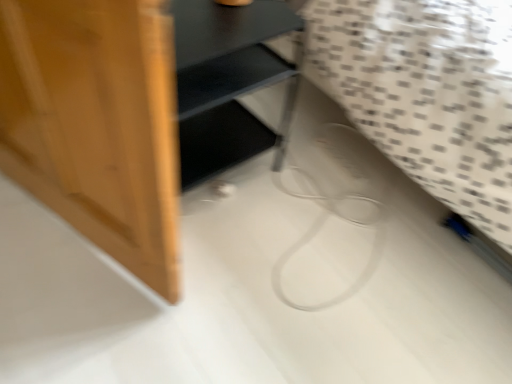
Question: Is matte black shelf at center taller or shorter than white textured fabric at lower right?

Choices:
 (A) short
 (B) tall

Answer: (A)

Question: In the image, is matte black shelf at center on the left side or the right side of white textured fabric at lower right?

Choices:
 (A) right
 (B) left

Answer: (B)

Question: Is matte black shelf at center inside or outside of white textured fabric at lower right?

Choices:
 (A) outside
 (B) inside

Answer: (A)

Question: Choose the correct answer: Is white textured fabric at lower right inside matte black shelf at center or outside it?

Choices:
 (A) inside
 (B) outside

Answer: (B)

Question: From their relative heights in the image, would you say white textured fabric at lower right is taller or shorter than matte black shelf at center?

Choices:
 (A) short
 (B) tall

Answer: (B)

Question: In the image, is white textured fabric at lower right positioned in front of or behind matte black shelf at center?

Choices:
 (A) front
 (B) behind

Answer: (A)

Question: From the image's perspective, relative to matte black shelf at center, is white textured fabric at lower right above or below?

Choices:
 (A) above
 (B) below

Answer: (A)